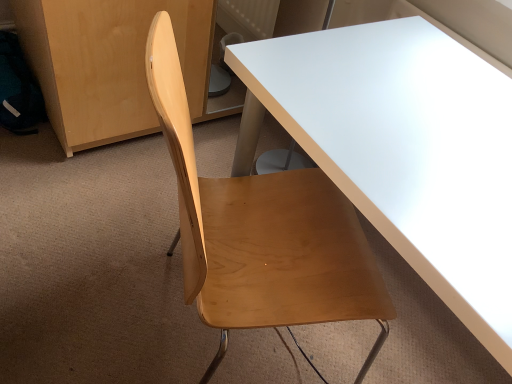
Where is `free location above white glossy table at upper center (from a real-world perspective)`? Image resolution: width=512 pixels, height=384 pixels. free location above white glossy table at upper center (from a real-world perspective) is located at coordinates (412, 115).